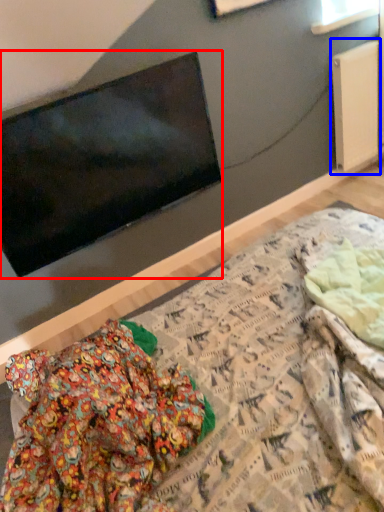
Question: Which object is closer to the camera taking this photo, television (highlighted by a red box) or radiator (highlighted by a blue box)?

Choices:
 (A) television
 (B) radiator

Answer: (A)